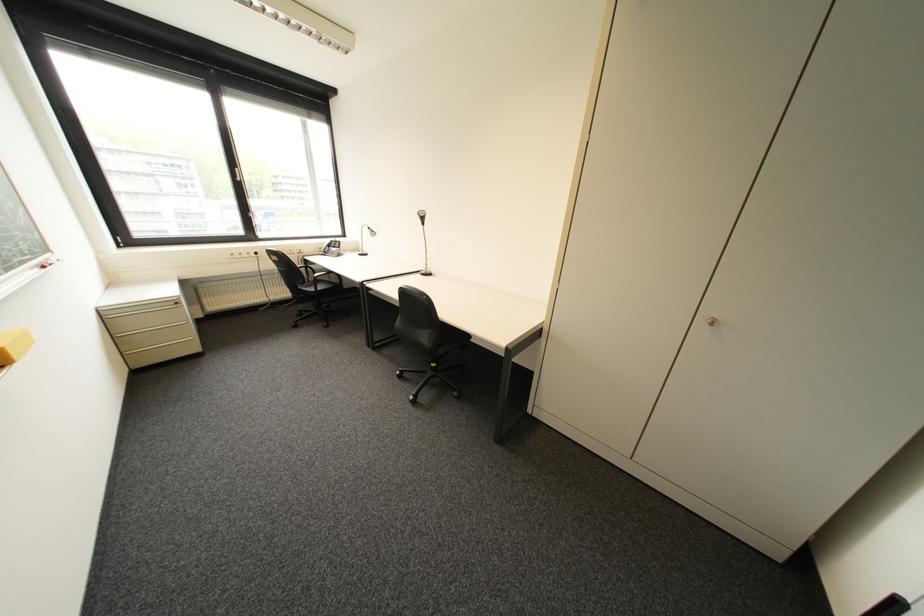
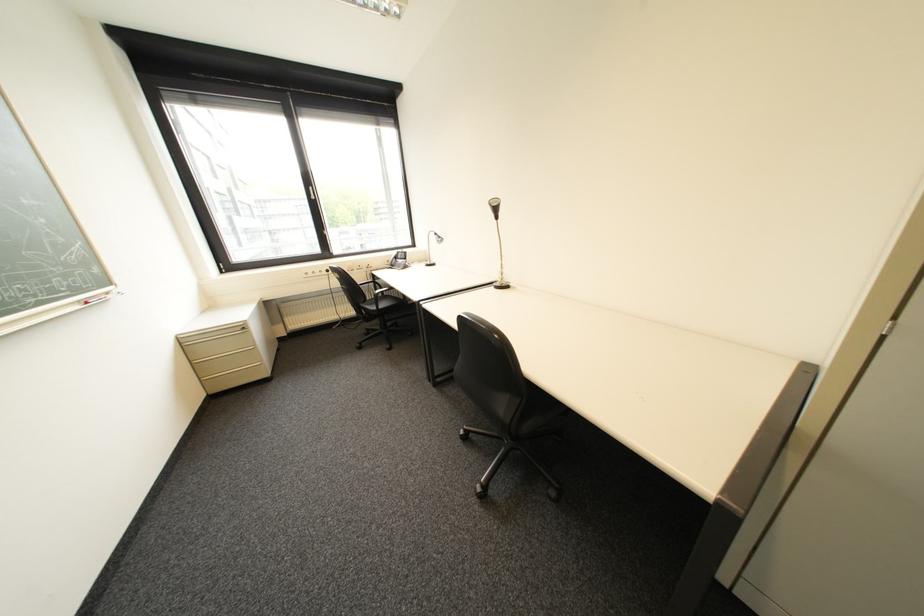
Question: What movement of the cameraman would produce the second image?

Choices:
 (A) Left
 (B) Right
 (C) Forward
 (D) Backward

Answer: (C)